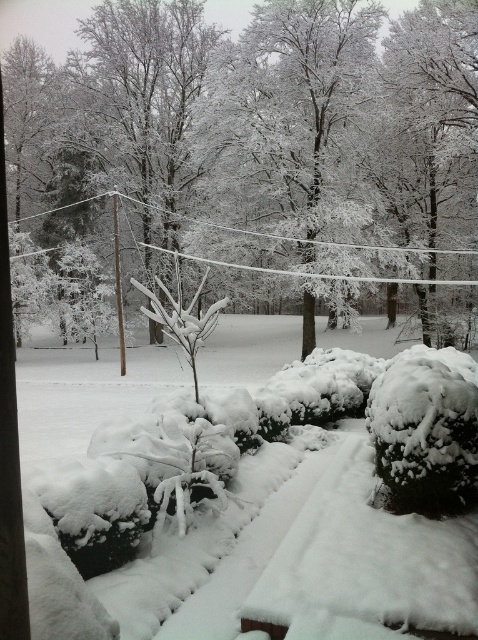
Question: Can you confirm if white frosty tree at center is positioned to the left of white fluffy snow at center?

Choices:
 (A) no
 (B) yes

Answer: (B)

Question: In this image, where is white frosty tree at center located relative to white fluffy snow at center?

Choices:
 (A) above
 (B) below

Answer: (A)

Question: Which object is closer to the camera taking this photo?

Choices:
 (A) white fluffy snow at center
 (B) white frosty tree at center

Answer: (A)

Question: Can you confirm if white frosty tree at center is thinner than white fluffy snow at center?

Choices:
 (A) yes
 (B) no

Answer: (B)